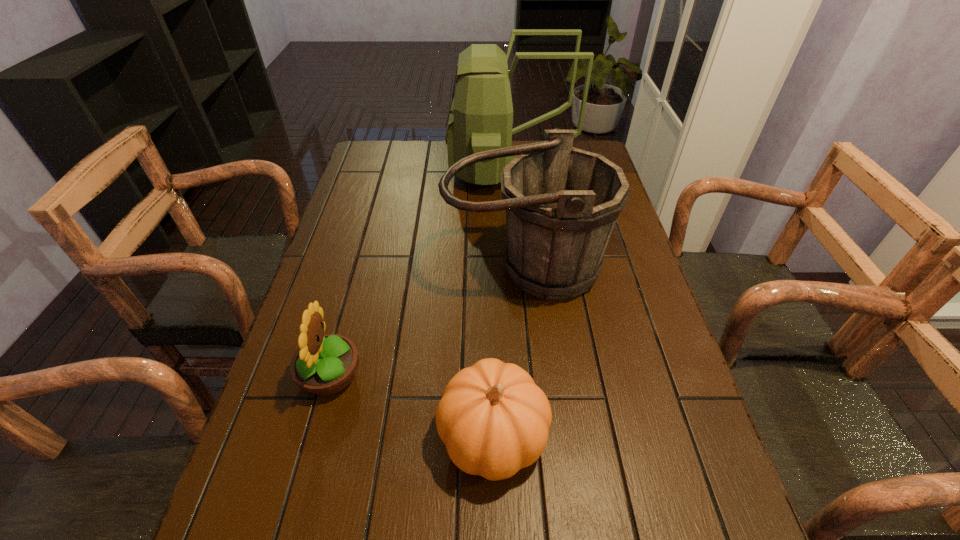
Locate an element on the screen. vacant space located 0.330m on the face of the sunflower is located at coordinates (512, 376).

Locate an element on the screen. The height and width of the screenshot is (540, 960). vacant area situated 0.180m on the right of the pumpkin is located at coordinates (638, 436).

Identify the location of object present at the far edge. This screenshot has width=960, height=540. (480, 118).

This screenshot has height=540, width=960. What are the coordinates of `object that is at the left edge` in the screenshot? It's located at (324, 365).

Find the location of a particular element. The width and height of the screenshot is (960, 540). backpack that is at the right edge is located at coordinates (480, 118).

Image resolution: width=960 pixels, height=540 pixels. Identify the location of bucket at the right edge. (562, 203).

What are the coordinates of `object that is at the far right corner` in the screenshot? It's located at (480, 118).

Where is `free point at the far edge`? free point at the far edge is located at coordinates (436, 154).

Image resolution: width=960 pixels, height=540 pixels. I want to click on free space at the left edge of the desktop, so click(x=247, y=485).

Find the location of `free space at the far left corner`. free space at the far left corner is located at coordinates (373, 173).